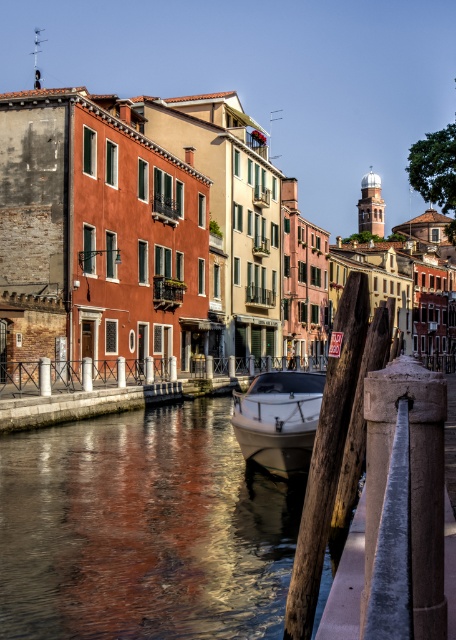
You are a tourist standing on a bridge overlooking the canal. You see the glossy water at center and the white glossy boat at center. Which object is located to the left of the other?

The glossy water at center is positioned on the left side of white glossy boat at center.